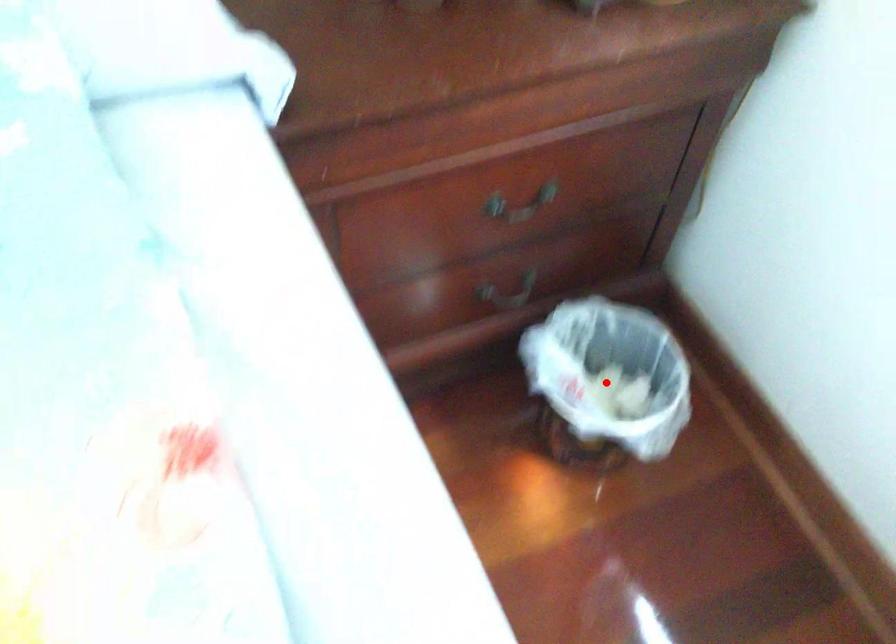
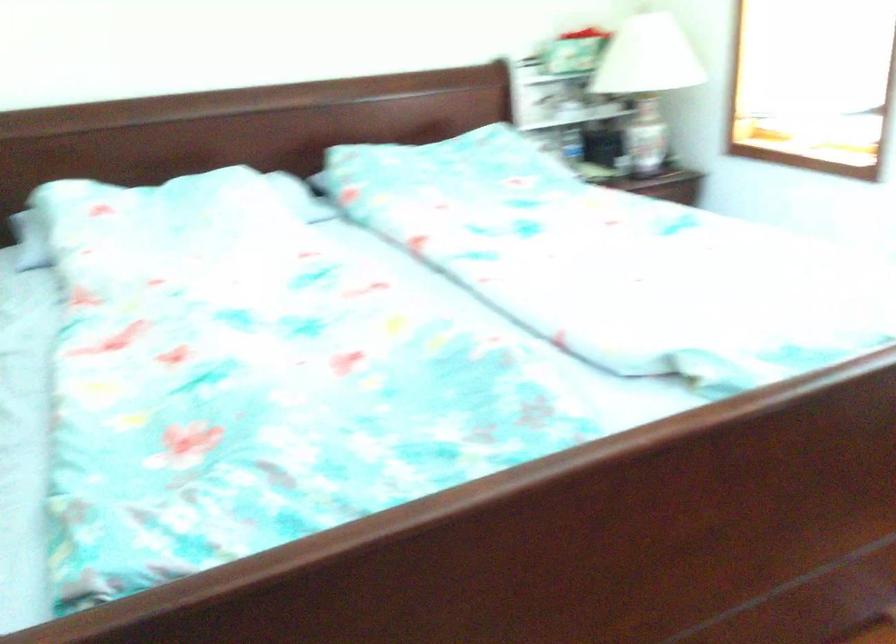
Question: I am providing you with two images of the same scene from different viewpoints. A red point is marked on the first image. Can you still see the location of the red point in image 2?

Choices:
 (A) Yes
 (B) No

Answer: (B)